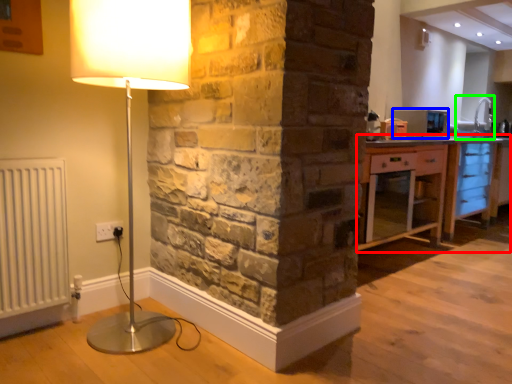
Question: Which is farther away from cabinetry (highlighted by a red box)? appliance (highlighted by a blue box) or sink (highlighted by a green box)?

Choices:
 (A) appliance
 (B) sink

Answer: (B)